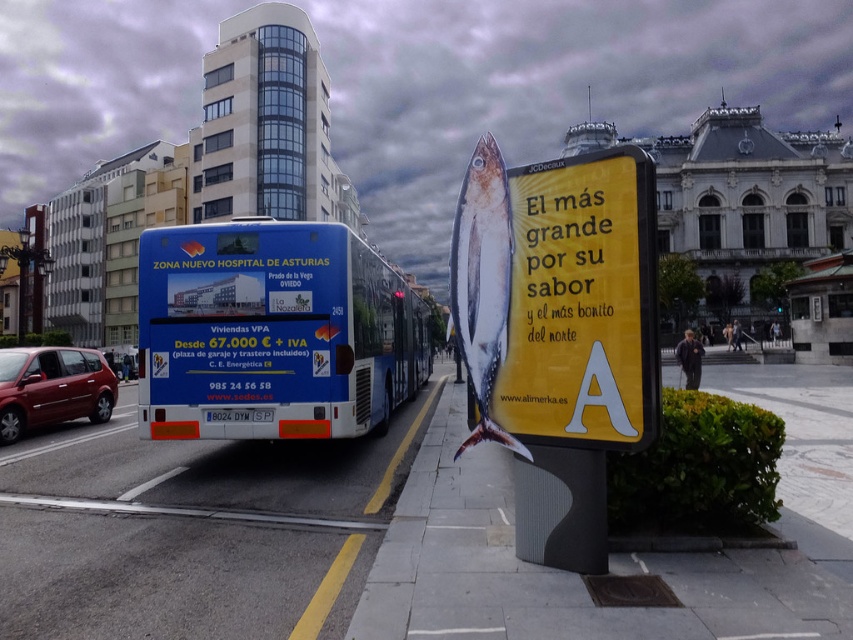
Question: Which object appears closest to the camera in this image?

Choices:
 (A) shiny red car at left
 (B) blue metallic bus at center

Answer: (B)

Question: Is yellow paperboard sign at center above blue metallic bus at center?

Choices:
 (A) yes
 (B) no

Answer: (A)

Question: Does blue metallic bus at center come behind shiny red car at left?

Choices:
 (A) no
 (B) yes

Answer: (A)

Question: Is yellow paperboard sign at center wider than shiny red car at left?

Choices:
 (A) no
 (B) yes

Answer: (A)

Question: Considering the real-world distances, which object is closest to the shiny red car at left?

Choices:
 (A) yellow paperboard sign at center
 (B) blue metallic bus at center

Answer: (B)

Question: Which of the following is the farthest from the observer?

Choices:
 (A) blue metallic bus at center
 (B) shiny red car at left
 (C) yellow paperboard sign at center

Answer: (B)